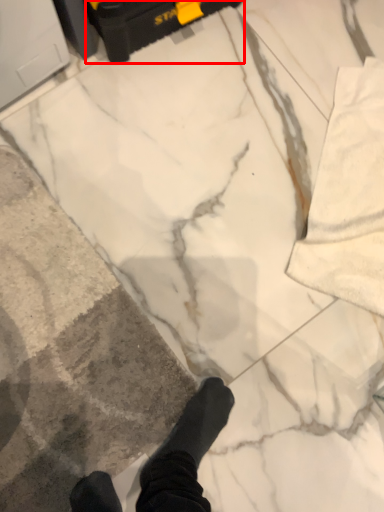
Question: In this image, where is equipment (annotated by the red box) located relative to concrete?

Choices:
 (A) left
 (B) right

Answer: (B)